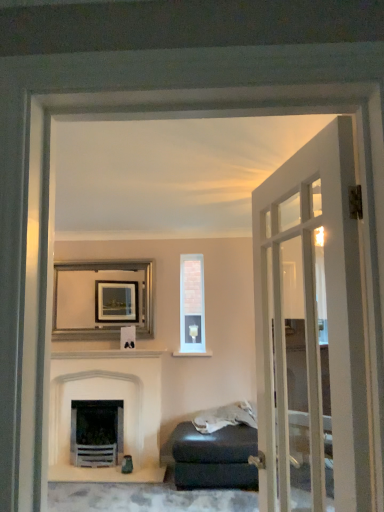
Question: Is matte black ottoman at lower right inside the boundaries of gray leather ottoman at lower right, or outside?

Choices:
 (A) inside
 (B) outside

Answer: (B)

Question: From the image's perspective, is matte black ottoman at lower right positioned above or below gray leather ottoman at lower right?

Choices:
 (A) above
 (B) below

Answer: (B)

Question: Estimate the real-world distances between objects in this image. Which object is closer to the white stone fireplace at center?

Choices:
 (A) silver metallic picture frame at upper center
 (B) clear glass window at center
 (C) gray leather ottoman at lower right
 (D) matte black ottoman at lower right
 (E) white glass door at right

Answer: (A)

Question: Estimate the real-world distances between objects in this image. Which object is farther from the clear glass window at center?

Choices:
 (A) silver metallic picture frame at upper center
 (B) matte black ottoman at lower right
 (C) white stone fireplace at center
 (D) gray leather ottoman at lower right
 (E) white glass door at right

Answer: (E)